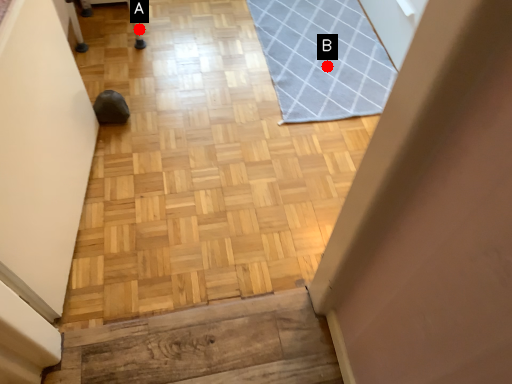
Question: Two points are circled on the image, labeled by A and B beside each circle. Which point is closer to the camera?

Choices:
 (A) A is closer
 (B) B is closer

Answer: (B)